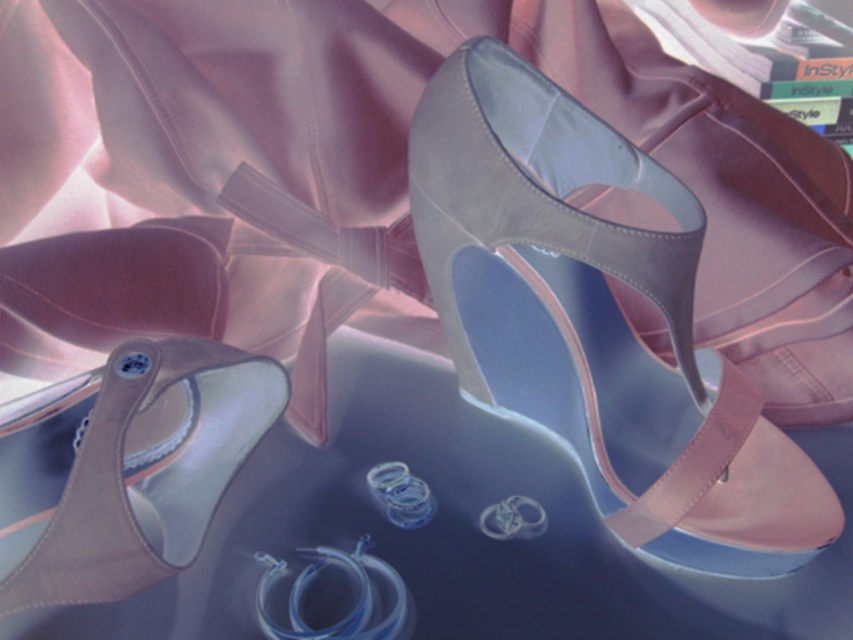
Question: Does satin beige high-heeled sandal at center have a larger size compared to satin beige sandal at lower left?

Choices:
 (A) no
 (B) yes

Answer: (B)

Question: Which point appears closest to the camera in this image?

Choices:
 (A) (769, 547)
 (B) (10, 490)

Answer: (A)

Question: Which point appears farthest from the camera in this image?

Choices:
 (A) (664, 400)
 (B) (271, 412)

Answer: (A)

Question: Can you confirm if satin beige high-heeled sandal at center is positioned to the left of satin beige sandal at lower left?

Choices:
 (A) no
 (B) yes

Answer: (A)

Question: Is satin beige high-heeled sandal at center wider than satin beige sandal at lower left?

Choices:
 (A) yes
 (B) no

Answer: (A)

Question: Among these objects, which one is nearest to the camera?

Choices:
 (A) satin beige sandal at lower left
 (B) satin beige high-heeled sandal at center

Answer: (A)